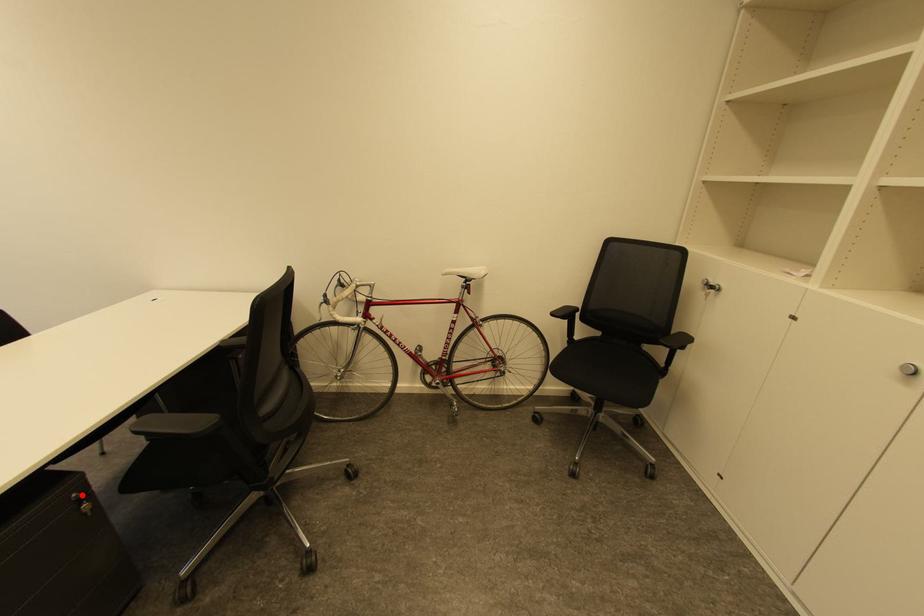
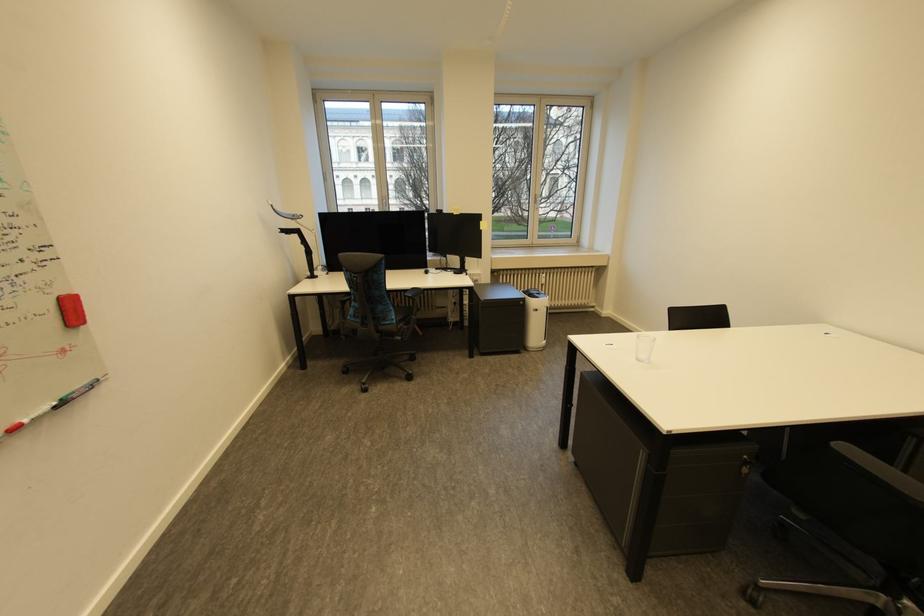
Where in the second image is the point corresponding to the highlighted location from the first image?

(752, 456)